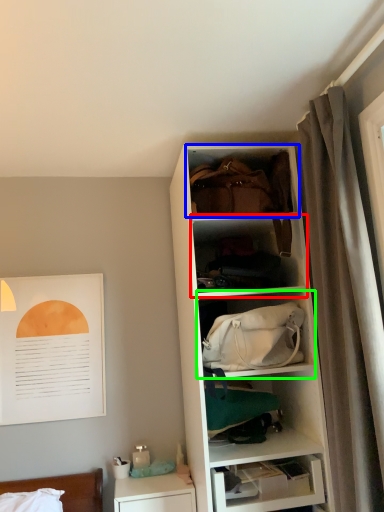
Question: Which object is the closest to the shelf (highlighted by a red box)? Choose among these: cabinet (highlighted by a blue box) or shelf (highlighted by a green box).

Choices:
 (A) cabinet
 (B) shelf

Answer: (A)